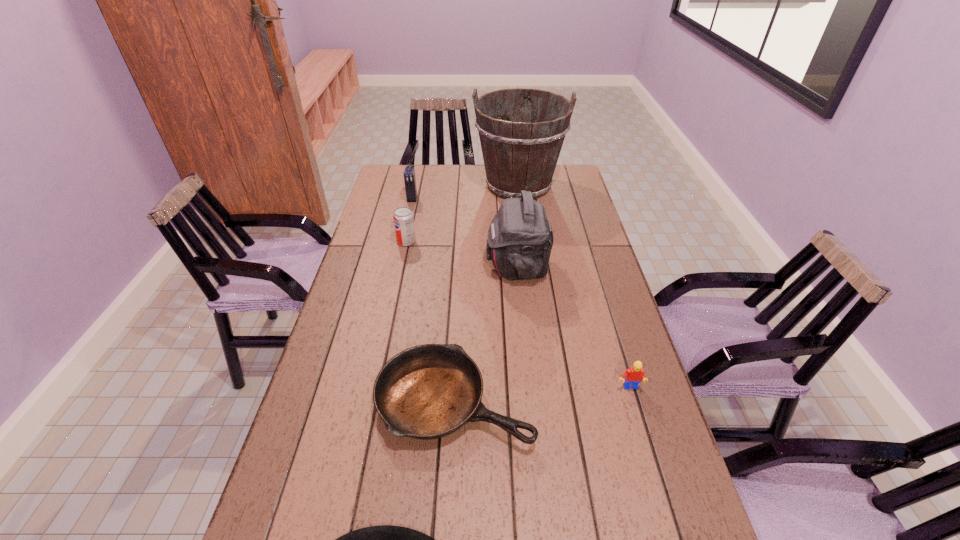
Locate an element on the screen. This screenshot has height=540, width=960. the tallest object is located at coordinates (522, 155).

Locate an element on the screen. The width and height of the screenshot is (960, 540). shoulder bag is located at coordinates (520, 238).

The image size is (960, 540). Identify the location of clutch bag. pyautogui.click(x=409, y=173).

Locate an element on the screen. The width and height of the screenshot is (960, 540). soda is located at coordinates tap(403, 218).

Find the location of `Lego`. Lego is located at coordinates (634, 375).

Identify the location of the shortest object. This screenshot has width=960, height=540. (429, 391).

The image size is (960, 540). Find the location of `free space located 0.050m on the right of the tallest object`. free space located 0.050m on the right of the tallest object is located at coordinates (576, 185).

Locate an element on the screen. The height and width of the screenshot is (540, 960). free spot located 0.140m on the open flap of the second tallest object is located at coordinates (444, 266).

You are a GUI agent. You are given a task and a screenshot of the screen. Output one action in this format:
    pyautogui.click(x=<x>, y=<y>)
    Task: Click on the blank area located 0.290m on the open flap of the second tallest object
    
    Given the screenshot: What is the action you would take?
    pyautogui.click(x=398, y=266)

Where is `vacant space located 0.080m on the open flap of the second tallest object`? This screenshot has height=540, width=960. vacant space located 0.080m on the open flap of the second tallest object is located at coordinates (462, 266).